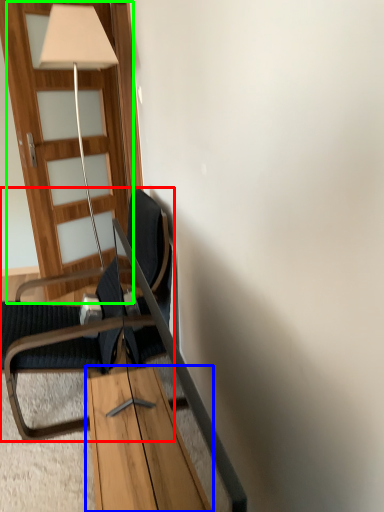
Question: Which object is the farthest from chair (highlighted by a red box)? Choose among these: table (highlighted by a blue box) or door (highlighted by a green box).

Choices:
 (A) table
 (B) door

Answer: (B)